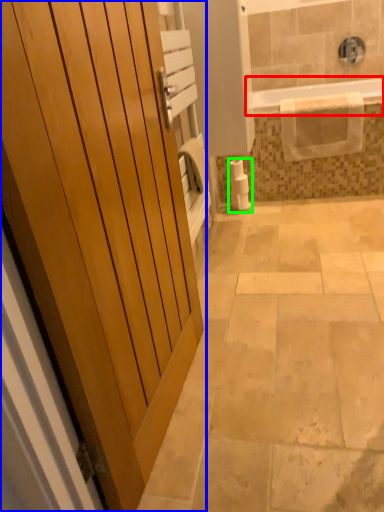
Question: Based on their relative distances, which object is nearer to bathtub (highlighted by a red box)? Choose from door (highlighted by a blue box) and toilet paper (highlighted by a green box).

Choices:
 (A) door
 (B) toilet paper

Answer: (B)